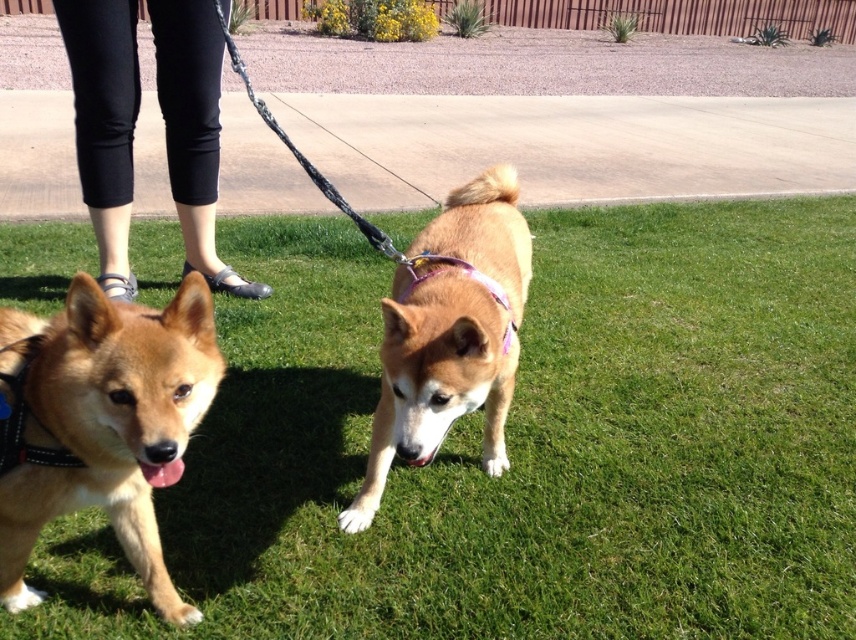
Question: Is green grass at center smaller than golden fur dog at lower left?

Choices:
 (A) yes
 (B) no

Answer: (B)

Question: Among these objects, which one is nearest to the camera?

Choices:
 (A) golden fur dog at lower left
 (B) green grass at center

Answer: (A)

Question: Is green grass at center wider than purple fabric neckband at center?

Choices:
 (A) no
 (B) yes

Answer: (B)

Question: Estimate the real-world distances between objects in this image. Which object is closer to the golden fur dog at lower left?

Choices:
 (A) purple fabric neckband at center
 (B) green grass at center
 (C) golden fur dog at center

Answer: (C)

Question: Which of the following is the farthest from the observer?

Choices:
 (A) (96, 179)
 (B) (752, 456)
 (C) (402, 372)
 (D) (407, 285)

Answer: (A)

Question: Is golden fur dog at lower left in front of black fabric pants at upper left?

Choices:
 (A) no
 (B) yes

Answer: (B)